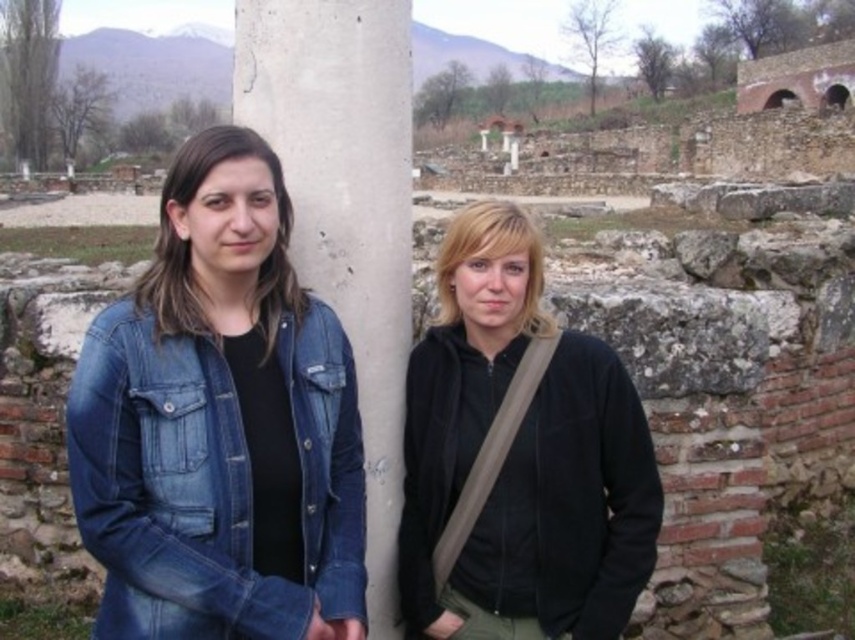
This screenshot has width=855, height=640. What do you see at coordinates (211, 481) in the screenshot? I see `denim jacket at left` at bounding box center [211, 481].

Between point (293, 337) and point (334, 214), which one is positioned behind?

The point (334, 214) is behind.

Is point (343, 384) farther from camera compared to point (261, 93)?

No, (343, 384) is closer to viewer.

This screenshot has width=855, height=640. Find the location of `denim jacket at left`. denim jacket at left is located at coordinates (211, 481).

Between black matte jacket at center and gray concrete pillar at center, which one is positioned higher?

gray concrete pillar at center

Is black matte jacket at center thinner than gray concrete pillar at center?

Yes.

Find the location of `black matte jacket at center`. black matte jacket at center is located at coordinates click(522, 456).

Locate an element on the screen. black matte jacket at center is located at coordinates (522, 456).

Between black matte jacket at center and denim jacket at left, which one has more height?

black matte jacket at center

Between black matte jacket at center and denim jacket at left, which one has less height?

denim jacket at left is shorter.

At what (x,y) coordinates should I click in order to perform the action: click on black matte jacket at center. Please return your answer as a coordinate pair (x, y). Image resolution: width=855 pixels, height=640 pixels. Looking at the image, I should click on (522, 456).